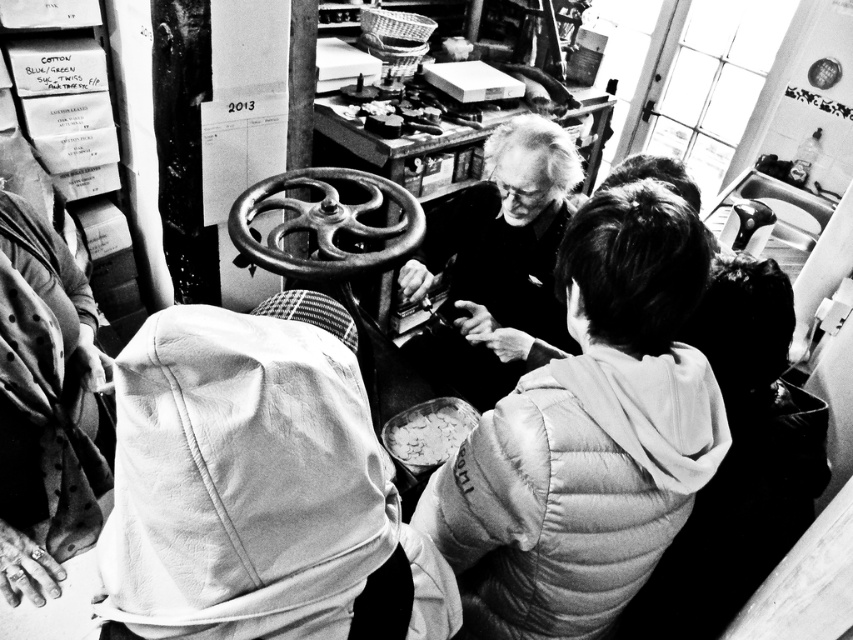
Question: Can you confirm if smooth black shirt at center is positioned below metallic polished wheel at center?

Choices:
 (A) no
 (B) yes

Answer: (B)

Question: Which of the following is the farthest from the observer?

Choices:
 (A) (535, 401)
 (B) (408, 435)

Answer: (B)

Question: Among these points, which one is nearest to the camera?

Choices:
 (A) (495, 177)
 (B) (543, 365)

Answer: (B)

Question: Does white puffer jacket at center appear over smooth black shirt at center?

Choices:
 (A) no
 (B) yes

Answer: (A)

Question: Which point is farther from the camera taking this photo?

Choices:
 (A) (523, 616)
 (B) (463, 292)
 (C) (413, 472)
 (D) (328, 195)

Answer: (B)

Question: Does white puffer jacket at center have a lesser width compared to metallic polished wheel at center?

Choices:
 (A) no
 (B) yes

Answer: (B)